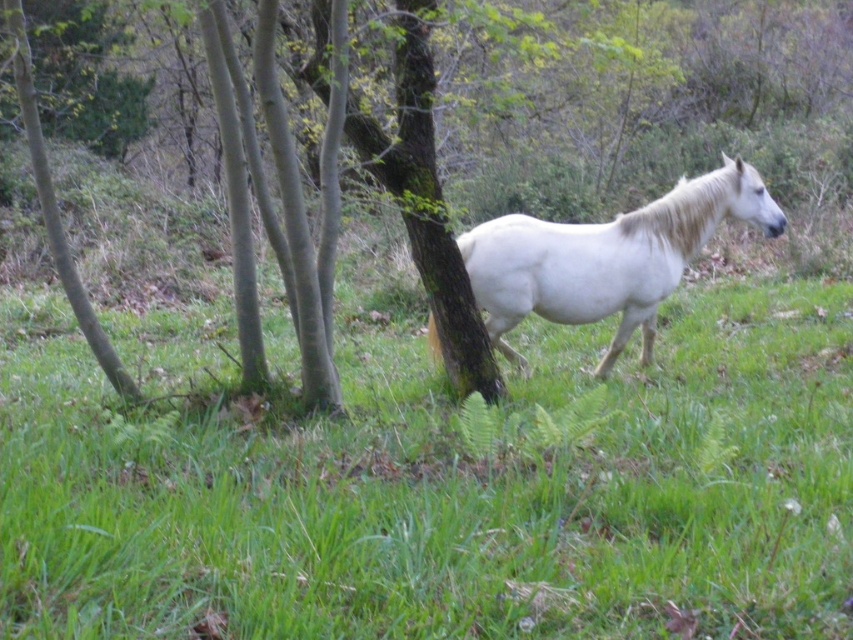
You are a hiker who wants to take a shortcut through the green grass at center and the brown rough tree at center. Which path would be easier to walk through?

The green grass at center is shorter than the brown rough tree at center, so the green grass at center would be easier to walk through.

You are a gardener trying to plant a new flowerbed between the green grass at center and the brown rough tree at center. Which area has more space to accommodate the flowers?

The brown rough tree at center has more space to accommodate the flowers because the green grass at center is thinner than it.

You are a photographer trying to capture the white matte horse at center from above. To get the best shot, you need to know if the green grass at center is directly underneath the horse. Is it?

Yes, the green grass at center is located below the white matte horse at center, so it is directly underneath the horse, making it ideal for capturing the shot from above.